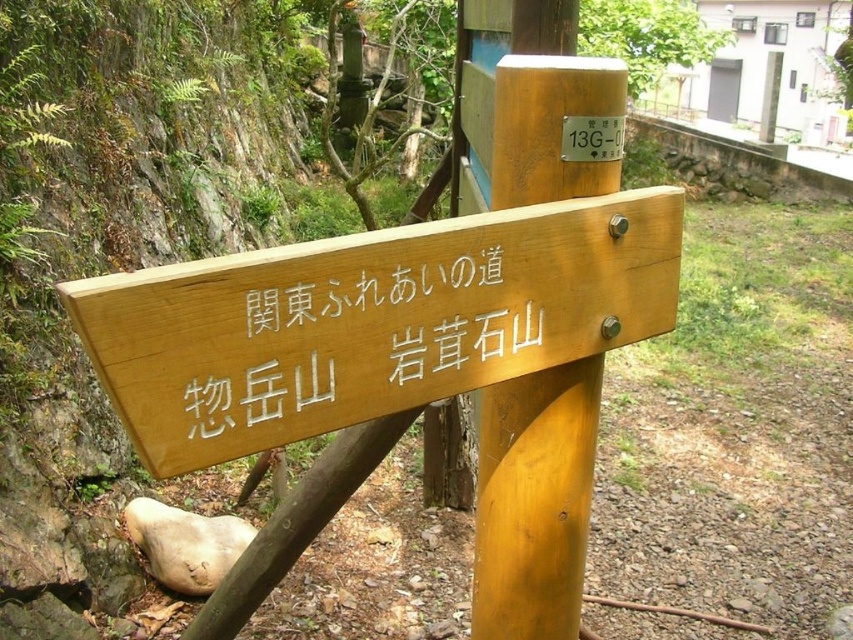
You are a hiker standing at the point marked by the coordinates (370, 321). What object is located exactly at your current position?

The natural wood sign at center is located exactly at the point marked by the coordinates (370, 321).

You are a hiker carrying a map and compass, and you come across the wooden sign at center and the wooden signpost at center. Your map shows that the distance between them should be exactly 12 inches. Based on the actual distance you observe, is the map accurate?

The wooden sign at center and wooden signpost at center are 11.64 inches apart, which is slightly less than the 12 inches shown on the map. Therefore, the map is not accurate.